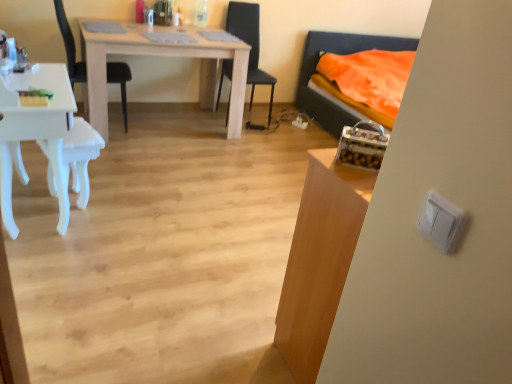
Question: Is white plastic light switch at right completely or partially outside of white glossy desk at left?

Choices:
 (A) yes
 (B) no

Answer: (A)

Question: Is white plastic light switch at right not close to white glossy desk at left?

Choices:
 (A) no
 (B) yes

Answer: (B)

Question: Is white plastic light switch at right facing towards white glossy desk at left?

Choices:
 (A) yes
 (B) no

Answer: (B)

Question: Is white plastic light switch at right behind white glossy desk at left?

Choices:
 (A) no
 (B) yes

Answer: (A)

Question: Does white plastic light switch at right have a smaller size compared to white glossy desk at left?

Choices:
 (A) yes
 (B) no

Answer: (A)

Question: Considering the positions of white glossy switch at right, the first table in the right-to-left sequence, and light wood table at center, which is the 1th table in back-to-front order, in the image, is white glossy switch at right, the first table in the right-to-left sequence, taller or shorter than light wood table at center, which is the 1th table in back-to-front order,?

Choices:
 (A) tall
 (B) short

Answer: (A)

Question: From a real-world perspective, is white glossy switch at right, the second table from the back, physically located above or below light wood table at center, which is the 1th table in back-to-front order?

Choices:
 (A) above
 (B) below

Answer: (A)

Question: Do you think white glossy switch at right, which ranks as the 1th table in bottom-to-top order, is within light wood table at center, which appears as the first table when viewed from the left, or outside of it?

Choices:
 (A) inside
 (B) outside

Answer: (B)

Question: Relative to light wood table at center, arranged as the 2th table when viewed from the right, is white glossy switch at right, which ranks as the second table in left-to-right order, in front or behind?

Choices:
 (A) behind
 (B) front

Answer: (B)

Question: Relative to white glossy switch at right, the first table viewed from the front, is white glossy desk at left in front or behind?

Choices:
 (A) behind
 (B) front

Answer: (A)

Question: From a real-world perspective, relative to white glossy switch at right, the first table in the right-to-left sequence, is white glossy desk at left vertically above or below?

Choices:
 (A) below
 (B) above

Answer: (A)

Question: From their relative heights in the image, would you say white glossy desk at left is taller or shorter than white glossy switch at right, which ranks as the 1th table in bottom-to-top order?

Choices:
 (A) tall
 (B) short

Answer: (B)

Question: Is white glossy desk at left to the left or to the right of white glossy switch at right, the second table from the top, in the image?

Choices:
 (A) right
 (B) left

Answer: (B)

Question: Is light wood table at center, arranged as the 2th table when viewed from the right, wider or thinner than white plastic light switch at right?

Choices:
 (A) thin
 (B) wide

Answer: (B)

Question: From their relative heights in the image, would you say light wood table at center, which is the 1th table in back-to-front order, is taller or shorter than white plastic light switch at right?

Choices:
 (A) tall
 (B) short

Answer: (A)